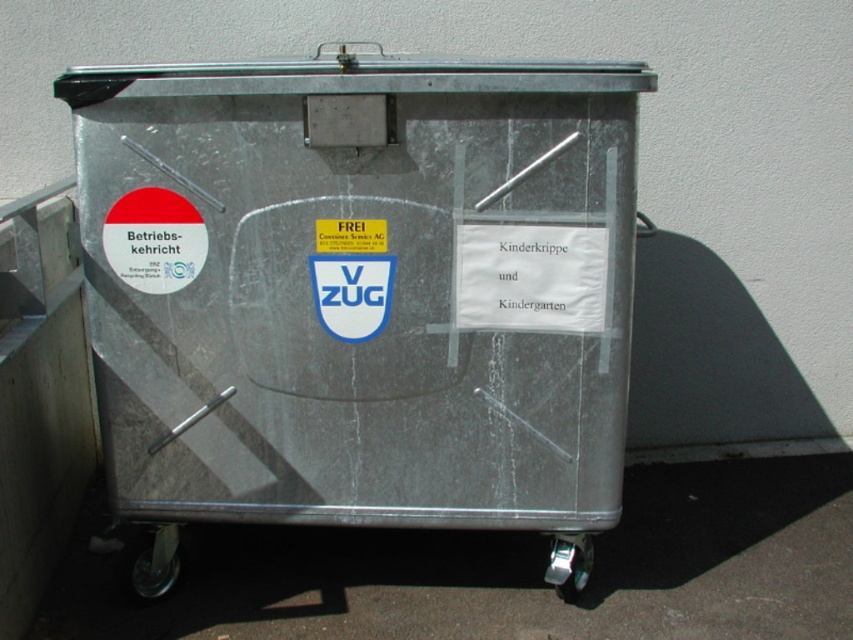
Does metallic trash can at center appear on the right side of metallic at lower left?

Correct, you'll find metallic trash can at center to the right of metallic at lower left.

Is metallic trash can at center positioned in front of metallic at lower left?

Yes.

Between point (154, 339) and point (169, 593), which one is positioned behind?

Positioned behind is point (169, 593).

Where is `metallic trash can at center`? metallic trash can at center is located at coordinates (392, 291).

Does metallic trash can at center have a lesser width compared to black rubber wheel at lower right?

In fact, metallic trash can at center might be wider than black rubber wheel at lower right.

Between metallic trash can at center and black rubber wheel at lower right, which one appears on the right side from the viewer's perspective?

From the viewer's perspective, black rubber wheel at lower right appears more on the right side.

Who is more forward, (252, 392) or (575, 595)?

Point (252, 392) is in front.

Identify the location of metallic trash can at center. (392, 291).

Which is more to the left, blue glossy shield at center or black rubber wheel at lower right?

blue glossy shield at center is more to the left.

Image resolution: width=853 pixels, height=640 pixels. Describe the element at coordinates (351, 292) in the screenshot. I see `blue glossy shield at center` at that location.

Which is in front, point (352, 289) or point (560, 545)?

Point (352, 289) is more forward.

Image resolution: width=853 pixels, height=640 pixels. What are the coordinates of `blue glossy shield at center` in the screenshot? It's located at (351, 292).